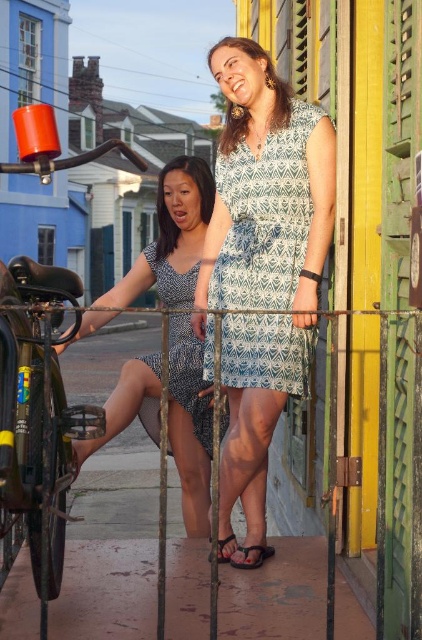
Can you confirm if blue printed dress at center is smaller than printed fabric dress at center?

Actually, blue printed dress at center might be larger than printed fabric dress at center.

Is blue printed dress at center above printed fabric dress at center?

Yes, blue printed dress at center is above printed fabric dress at center.

Where is `blue printed dress at center`? blue printed dress at center is located at coordinates (172, 237).

From the picture: Measure the distance from brown leather sandal at lower center to black rubber sandal at lower center.

brown leather sandal at lower center and black rubber sandal at lower center are 4.71 inches apart.

Can you confirm if brown leather sandal at lower center is positioned to the left of black rubber sandal at lower center?

In fact, brown leather sandal at lower center is to the right of black rubber sandal at lower center.

Who is more distant from viewer, (256, 561) or (221, 561)?

The point (221, 561) is behind.

This screenshot has height=640, width=422. Find the location of `brown leather sandal at lower center`. brown leather sandal at lower center is located at coordinates (256, 557).

Does printed cotton dress at center have a larger size compared to brown leather sandal at lower center?

Yes, printed cotton dress at center is bigger than brown leather sandal at lower center.

Locate an element on the screen. The image size is (422, 640). printed cotton dress at center is located at coordinates (265, 218).